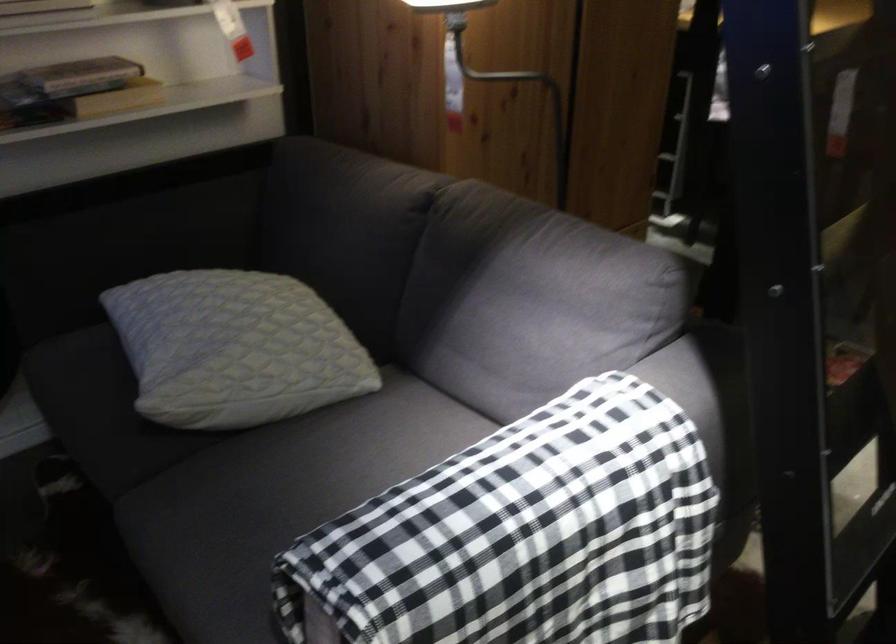
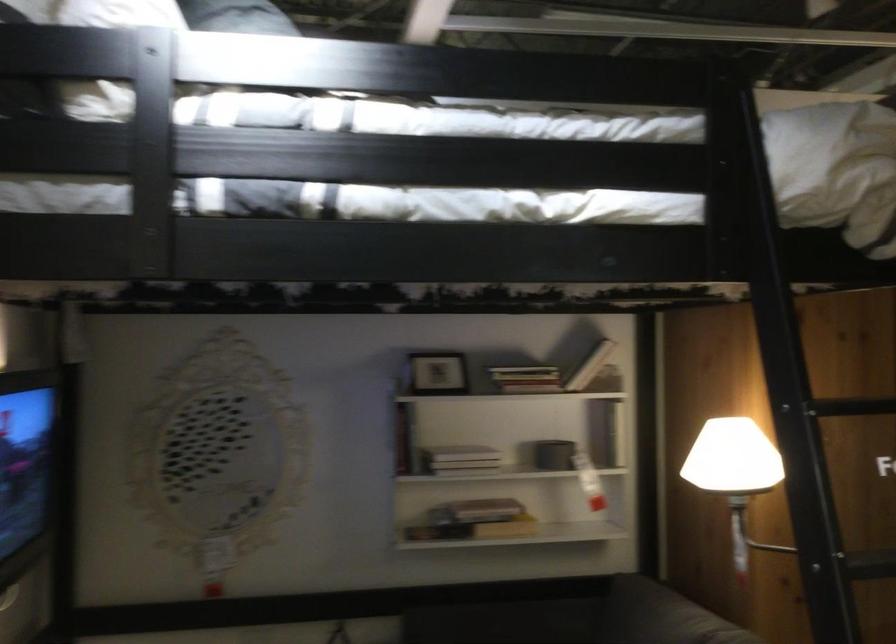
Locate, in the second image, the point that corresponds to point 82,109 in the first image.

(474, 529)